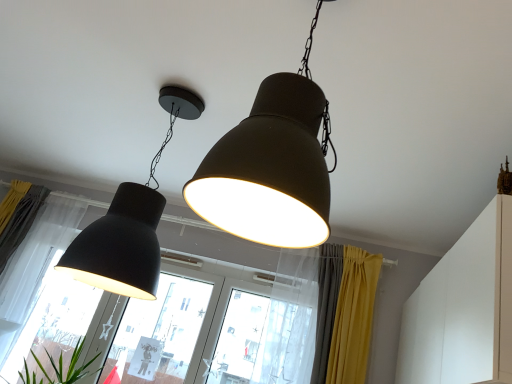
Question: Is matte black lampshade at left, the 2th lamp when ordered from front to back, at the back of yellow fabric curtain at lower right, which is counted as the first curtain, starting from the right?

Choices:
 (A) no
 (B) yes

Answer: (A)

Question: Considering the relative positions of yellow fabric curtain at lower right, arranged as the third curtain when viewed from the left, and matte black lampshade at left, which ranks as the first lamp in back-to-front order, in the image provided, is yellow fabric curtain at lower right, arranged as the third curtain when viewed from the left, to the right of matte black lampshade at left, which ranks as the first lamp in back-to-front order, from the viewer's perspective?

Choices:
 (A) no
 (B) yes

Answer: (B)

Question: From the image's perspective, is yellow fabric curtain at lower right, which is counted as the first curtain, starting from the right, located above matte black lampshade at left, the second lamp when ordered from right to left?

Choices:
 (A) no
 (B) yes

Answer: (A)

Question: Is yellow fabric curtain at lower right, arranged as the third curtain when viewed from the left, shorter than matte black lampshade at left, the 2th lamp when ordered from front to back?

Choices:
 (A) yes
 (B) no

Answer: (A)

Question: Does yellow fabric curtain at lower right, arranged as the third curtain when viewed from the left, appear on the left side of matte black lampshade at left, which ranks as the first lamp in back-to-front order?

Choices:
 (A) yes
 (B) no

Answer: (B)

Question: From a real-world perspective, does yellow fabric curtain at lower right, arranged as the third curtain when viewed from the left, stand above matte black lampshade at left, the 2th lamp when ordered from front to back?

Choices:
 (A) no
 (B) yes

Answer: (A)

Question: Considering the relative sizes of matte black lampshade at left and matte black lampshade at left, the 1th lamp from the left, in the image provided, is matte black lampshade at left smaller than matte black lampshade at left, the 1th lamp from the left,?

Choices:
 (A) no
 (B) yes

Answer: (A)

Question: From the image's perspective, is matte black lampshade at left above matte black lampshade at left, which ranks as the first lamp in back-to-front order?

Choices:
 (A) no
 (B) yes

Answer: (A)

Question: Is matte black lampshade at left shorter than matte black lampshade at left, the 2th lamp when ordered from front to back?

Choices:
 (A) yes
 (B) no

Answer: (A)

Question: From the image's perspective, would you say matte black lampshade at left is shown under matte black lampshade at left, which ranks as the first lamp in back-to-front order?

Choices:
 (A) yes
 (B) no

Answer: (A)

Question: Does matte black lampshade at left lie behind matte black lampshade at left, the second lamp when ordered from right to left?

Choices:
 (A) yes
 (B) no

Answer: (A)

Question: Could you tell me if matte black lampshade at left is turned towards matte black lampshade at left, which ranks as the first lamp in back-to-front order?

Choices:
 (A) no
 (B) yes

Answer: (B)

Question: Is matte black lampshade at left smaller than transparent glass window at center, which is the second window from right to left?

Choices:
 (A) yes
 (B) no

Answer: (B)